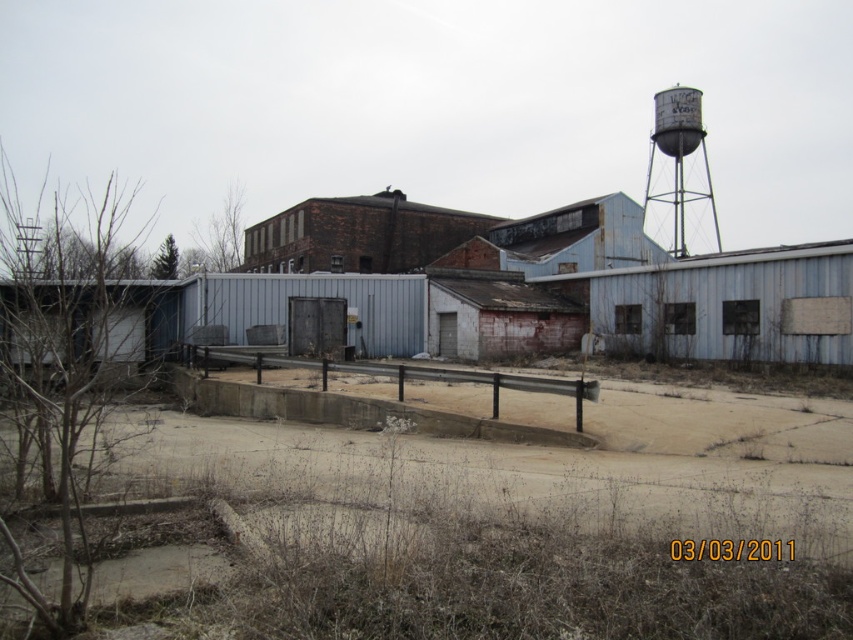
Question: Is brown dirt field at center closer to the viewer compared to rusty metal water tower at upper right?

Choices:
 (A) no
 (B) yes

Answer: (B)

Question: Is brown dirt field at center to the left of rusty metal water tower at upper right from the viewer's perspective?

Choices:
 (A) no
 (B) yes

Answer: (B)

Question: Where is brown dirt field at center located in relation to rusty metal water tower at upper right in the image?

Choices:
 (A) right
 (B) left

Answer: (B)

Question: Which point appears farthest from the camera in this image?

Choices:
 (A) (409, 483)
 (B) (688, 164)

Answer: (B)

Question: Among these objects, which one is nearest to the camera?

Choices:
 (A) rusty metal water tower at upper right
 (B) brown dirt field at center

Answer: (B)